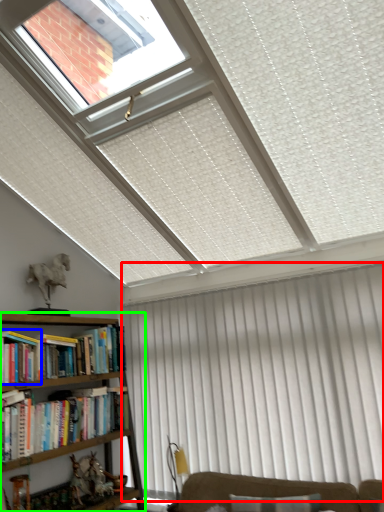
Question: Which object is positioned farthest from curtain (highlighted by a red box)? Select from book (highlighted by a blue box) and bookcase (highlighted by a green box).

Choices:
 (A) book
 (B) bookcase

Answer: (A)